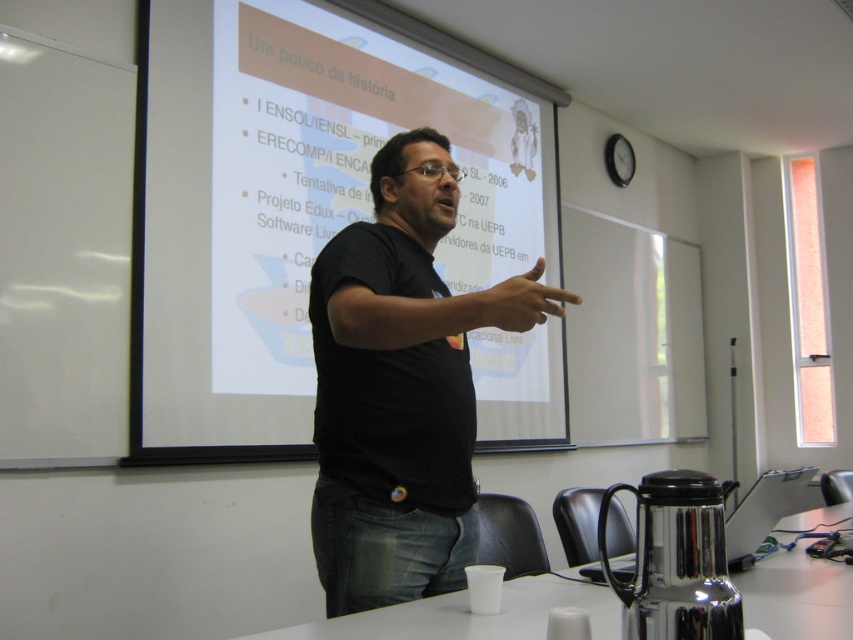
You are a photographer standing 2 meters away from the subject. You want to take a closeup shot of the black matte shirt at center. Is the subject within your camera lens range if the minimum focusing distance is 1.5 meters?

The black matte shirt at center is 1.34 meters away from the viewer. Since the minimum focusing distance is 1.5 meters, the subject is too close to be in focus. The photographer needs to move back or adjust the lens to ensure proper focus.

You are an attendee in the room and want to take a photo of the presentation. The white matte projection screen at upper center and the matte black finger at center are both in your camera view. Which object should you focus on to ensure the slide content is clearly visible in the photo?

You should focus on the white matte projection screen at upper center because it is to the left of the matte black finger at center, so it will be in the background and clearer in the photo.